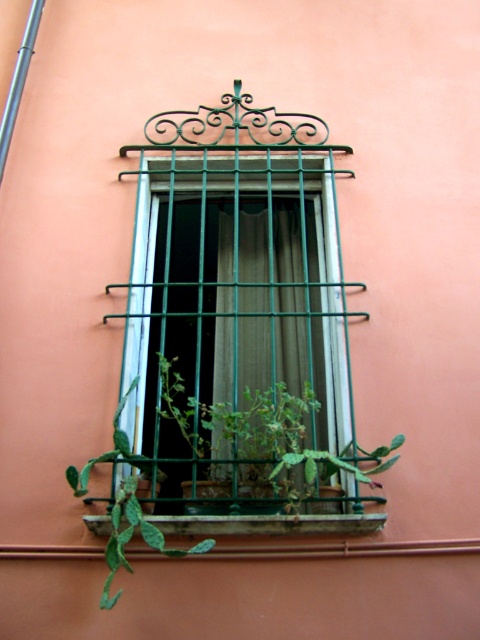
Is green metal window at center bigger than green metal/wooden window sill at lower center?

Indeed, green metal window at center has a larger size compared to green metal/wooden window sill at lower center.

This screenshot has height=640, width=480. I want to click on green metal window at center, so click(233, 321).

Between point (178, 378) and point (254, 525), which one is positioned behind?

Positioned behind is point (178, 378).

The height and width of the screenshot is (640, 480). In order to click on green metal window at center in this screenshot , I will do `click(233, 321)`.

Which is in front, point (153, 216) or point (222, 353)?

Point (222, 353)

Can you confirm if green metal window at center is positioned below green sheer curtain at center?

Indeed, green metal window at center is positioned under green sheer curtain at center.

Which is behind, point (206, 422) or point (229, 464)?

Point (229, 464)

Locate an element on the screen. green metal window at center is located at coordinates (233, 321).

Is point (287, 344) positioned after point (130, 538)?

Yes, point (287, 344) is farther from viewer.

Can you confirm if green metal window at center is shorter than green spiky cactus at lower left?

No, green metal window at center is not shorter than green spiky cactus at lower left.

The image size is (480, 640). I want to click on green metal window at center, so click(x=233, y=321).